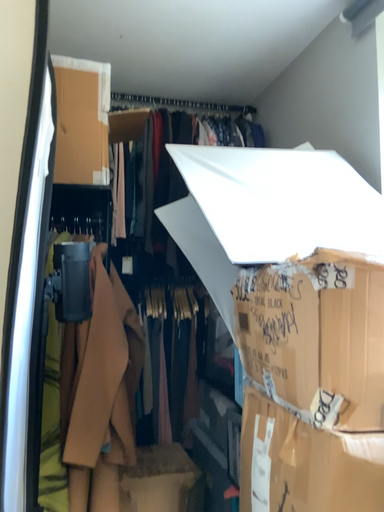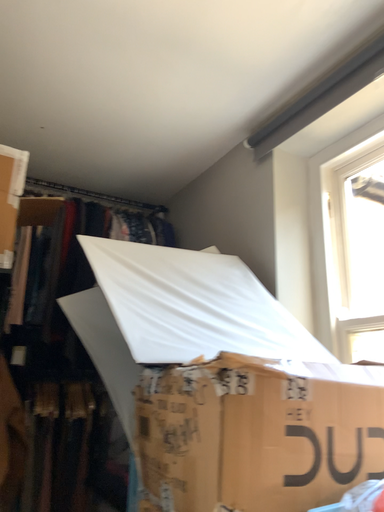
Question: How did the camera likely rotate when shooting the video?

Choices:
 (A) rotated downward
 (B) rotated upward

Answer: (B)